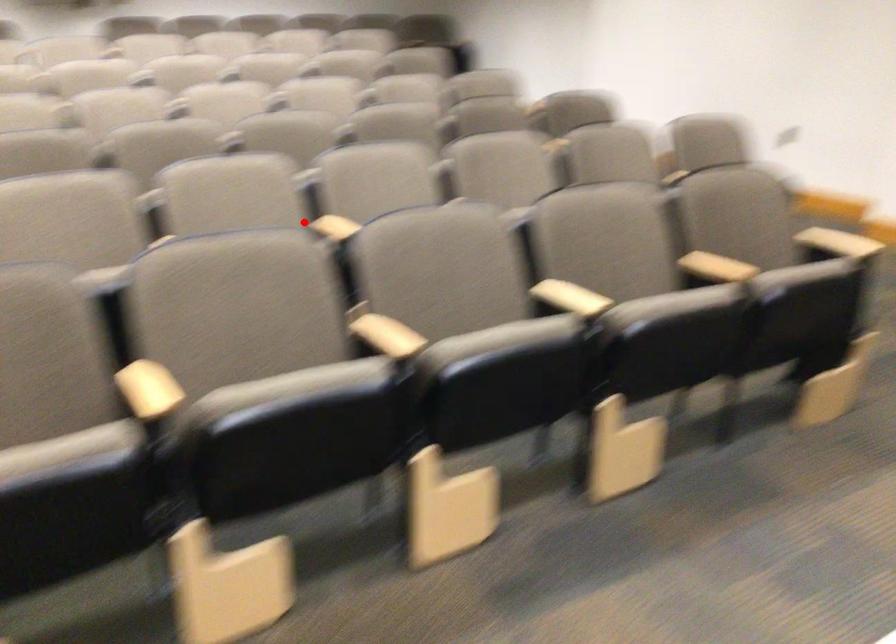
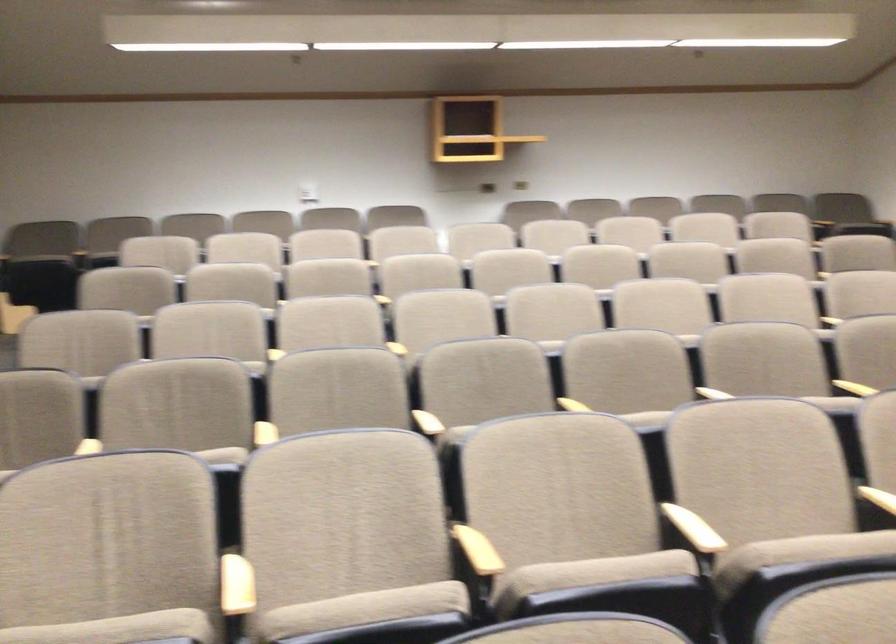
In the second image, find the point that corresponds to the highlighted location in the first image.

(877, 498)